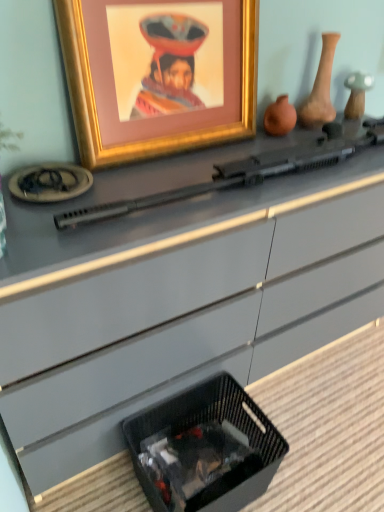
Where is `matte clay vase at upper right, the first vase from the right`? The image size is (384, 512). matte clay vase at upper right, the first vase from the right is located at coordinates (320, 88).

Where is `black woven basket at lower center`? black woven basket at lower center is located at coordinates (208, 443).

Image resolution: width=384 pixels, height=512 pixels. What are the coordinates of `basket beneath the black plastic rifle at center (from a real-world perspective)` in the screenshot? It's located at (208, 443).

From a real-world perspective, between black woven basket at lower center and black plastic rifle at center, who is vertically higher?

From a 3D spatial view, black plastic rifle at center is above.

Consider the image. Which object is positioned more to the right, black woven basket at lower center or black plastic rifle at center?

From the viewer's perspective, black plastic rifle at center appears more on the right side.

Is black woven basket at lower center oriented towards black plastic rifle at center?

No, black woven basket at lower center does not turn towards black plastic rifle at center.

Based on the photo, is the position of gold-framed picture at upper center less distant than that of matte clay vase at upper right, the first vase from the right?

Yes, gold-framed picture at upper center is in front of matte clay vase at upper right, the first vase from the right.

Considering the relative positions of gold-framed picture at upper center and matte clay vase at upper right, the first vase from the right, in the image provided, is gold-framed picture at upper center to the left of matte clay vase at upper right, the first vase from the right, from the viewer's perspective?

Indeed, gold-framed picture at upper center is positioned on the left side of matte clay vase at upper right, the first vase from the right.

Locate an element on the screen. vase above the gold-framed picture at upper center (from the image's perspective) is located at coordinates (320, 88).

How many degrees apart are the facing directions of gold-framed picture at upper center and matte clay vase at upper right, the first vase from the right?

The angle between the facing direction of gold-framed picture at upper center and the facing direction of matte clay vase at upper right, the first vase from the right, is 4.44 degrees.

Is black woven basket at lower center in front of gold-framed picture at upper center?

No, it is not.

Is black woven basket at lower center facing towards gold-framed picture at upper center?

No.

Which is behind, point (303, 111) or point (169, 4)?

Point (303, 111)

Is the position of matte clay vase at upper right, the first vase from the right, more distant than that of gold-framed picture at upper center?

Yes, matte clay vase at upper right, the first vase from the right, is further from the viewer.

You are a GUI agent. You are given a task and a screenshot of the screen. Output one action in this format:
    pyautogui.click(x=<x>, y=<y>)
    Task: Click on the vase that is the 1st one below the gold-framed picture at upper center (from a real-world perspective)
    
    Given the screenshot: What is the action you would take?
    pyautogui.click(x=320, y=88)

From the picture: Is matte clay vase at upper right, placed as the second vase when sorted from left to right, to the left of gold-framed picture at upper center from the viewer's perspective?

No.

Do you think black woven basket at lower center is within matte clay vase at upper center, the first vase in the left-to-right sequence, or outside of it?

black woven basket at lower center exists outside the volume of matte clay vase at upper center, the first vase in the left-to-right sequence.

Considering the sizes of objects black woven basket at lower center and matte clay vase at upper center, the first vase in the left-to-right sequence, in the image provided, who is thinner, black woven basket at lower center or matte clay vase at upper center, the first vase in the left-to-right sequence,?

matte clay vase at upper center, the first vase in the left-to-right sequence.

Which is closer to the camera, (x=189, y=455) or (x=276, y=130)?

Positioned in front is point (x=189, y=455).

Is black woven basket at lower center placed right next to matte clay vase at upper center, the first vase in the left-to-right sequence?

black woven basket at lower center and matte clay vase at upper center, the first vase in the left-to-right sequence, are not in contact.

Is matte clay vase at upper center, which is the second vase in right-to-left order, to the left or to the right of matte clay vase at upper right, placed as the second vase when sorted from left to right, in the image?

From the image, it's evident that matte clay vase at upper center, which is the second vase in right-to-left order, is to the left of matte clay vase at upper right, placed as the second vase when sorted from left to right.

Consider the image. Considering their positions, is matte clay vase at upper center, the first vase in the left-to-right sequence, located in front of or behind matte clay vase at upper right, placed as the second vase when sorted from left to right?

matte clay vase at upper center, the first vase in the left-to-right sequence, is behind matte clay vase at upper right, placed as the second vase when sorted from left to right.

Can you confirm if matte clay vase at upper center, which is the second vase in right-to-left order, is thinner than matte clay vase at upper right, placed as the second vase when sorted from left to right?

Indeed, matte clay vase at upper center, which is the second vase in right-to-left order, has a lesser width compared to matte clay vase at upper right, placed as the second vase when sorted from left to right.

Can you confirm if matte clay vase at upper center, which is the second vase in right-to-left order, is shorter than matte clay vase at upper right, the first vase from the right?

Yes, matte clay vase at upper center, which is the second vase in right-to-left order, is shorter than matte clay vase at upper right, the first vase from the right.

Which of these two, matte clay vase at upper center, the first vase in the left-to-right sequence, or black woven basket at lower center, is thinner?

matte clay vase at upper center, the first vase in the left-to-right sequence.

From the image's perspective, between matte clay vase at upper center, the first vase in the left-to-right sequence, and black woven basket at lower center, which one is located above?

matte clay vase at upper center, the first vase in the left-to-right sequence.

Is matte clay vase at upper center, which is the second vase in right-to-left order, shorter than black woven basket at lower center?

Yes.

Is matte clay vase at upper center, the first vase in the left-to-right sequence, to the left or to the right of black woven basket at lower center in the image?

From the image, it's evident that matte clay vase at upper center, the first vase in the left-to-right sequence, is to the right of black woven basket at lower center.

This screenshot has height=512, width=384. Identify the location of basket behind the black plastic rifle at center. (208, 443).

Identify the location of the 1st vase directly beneath the gold-framed picture at upper center (from a real-world perspective). (320, 88).

From the image, which object appears to be nearer to black woven basket at lower center, black plastic rifle at center or gold-framed picture at upper center?

The object closer to black woven basket at lower center is black plastic rifle at center.

From the image, which object appears to be nearer to matte clay vase at upper center, the first vase in the left-to-right sequence, gold-framed picture at upper center or matte clay vase at upper right, the first vase from the right?

Among the two, matte clay vase at upper right, the first vase from the right, is located nearer to matte clay vase at upper center, the first vase in the left-to-right sequence.

Looking at the image, which one is located further to gold-framed picture at upper center, matte clay vase at upper right, placed as the second vase when sorted from left to right, or matte clay vase at upper center, which is the second vase in right-to-left order?

Among the two, matte clay vase at upper right, placed as the second vase when sorted from left to right, is located further to gold-framed picture at upper center.

Which object lies nearer to the anchor point gold-framed picture at upper center, black plastic rifle at center or matte clay vase at upper right, the first vase from the right?

The object closer to gold-framed picture at upper center is black plastic rifle at center.

From the image, which object appears to be nearer to gold-framed picture at upper center, black woven basket at lower center or black plastic rifle at center?

black plastic rifle at center lies closer to gold-framed picture at upper center than the other object.

In the scene shown: Estimate the real-world distances between objects in this image. Which object is closer to gold-framed picture at upper center, matte clay vase at upper center, the first vase in the left-to-right sequence, or black woven basket at lower center?

Based on the image, matte clay vase at upper center, the first vase in the left-to-right sequence, appears to be nearer to gold-framed picture at upper center.

From the image, which object appears to be nearer to black woven basket at lower center, gold-framed picture at upper center or matte clay vase at upper right, the first vase from the right?

The object closer to black woven basket at lower center is gold-framed picture at upper center.

Considering their positions, is black woven basket at lower center positioned further to black plastic rifle at center than matte clay vase at upper center, which is the second vase in right-to-left order?

The object further to black plastic rifle at center is black woven basket at lower center.

I want to click on weapon between matte clay vase at upper center, which is the second vase in right-to-left order, and black woven basket at lower center from top to bottom, so click(247, 170).

Locate an element on the screen. vase between black plastic rifle at center and matte clay vase at upper center, which is the second vase in right-to-left order, along the z-axis is located at coordinates (320, 88).

The height and width of the screenshot is (512, 384). I want to click on picture frame between matte clay vase at upper right, placed as the second vase when sorted from left to right, and black woven basket at lower center, in the vertical direction, so click(x=158, y=74).

You are a GUI agent. You are given a task and a screenshot of the screen. Output one action in this format:
    pyautogui.click(x=<x>, y=<y>)
    Task: Click on the weapon between matte clay vase at upper right, the first vase from the right, and black woven basket at lower center vertically
    This screenshot has width=384, height=512.
    Given the screenshot: What is the action you would take?
    pyautogui.click(x=247, y=170)